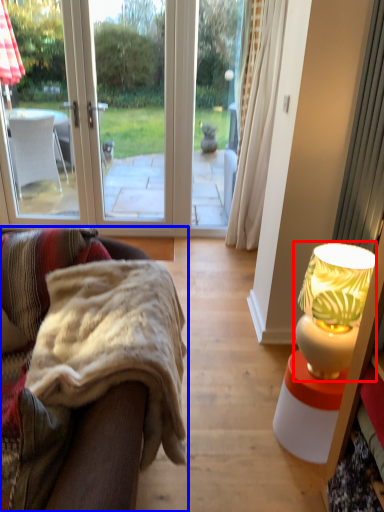
Question: Among these objects, which one is nearest to the camera, lamp (highlighted by a red box) or studio couch (highlighted by a blue box)?

Choices:
 (A) lamp
 (B) studio couch

Answer: (B)